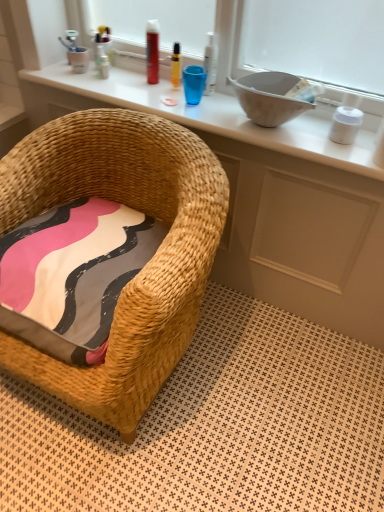
Locate an element on the screen. free point above woven wood changing table at upper center (from a real-world perspective) is located at coordinates (189, 100).